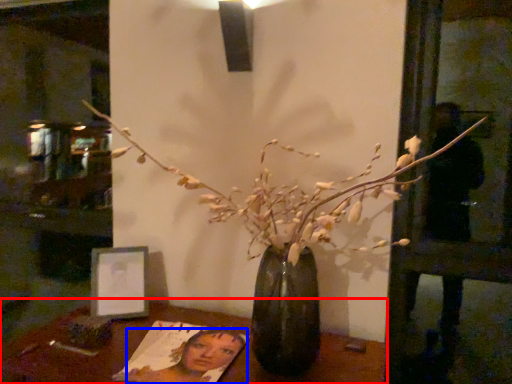
Question: Which object appears closest to the camera in this image, table (highlighted by a red box) or woman (highlighted by a blue box)?

Choices:
 (A) table
 (B) woman

Answer: (A)